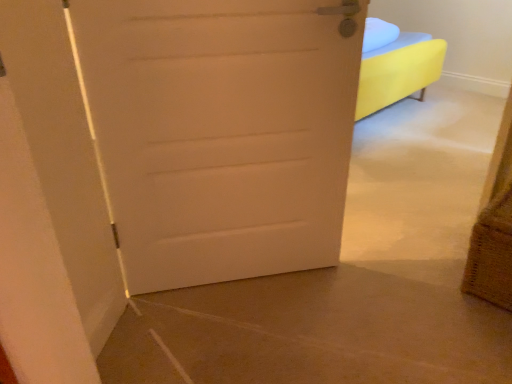
Question: Is white matte door at center spatially inside burlap basket at lower right, or outside of it?

Choices:
 (A) inside
 (B) outside

Answer: (B)

Question: Would you say white matte door at center is to the left or to the right of burlap basket at lower right in the picture?

Choices:
 (A) right
 (B) left

Answer: (B)

Question: Is white matte door at center taller or shorter than burlap basket at lower right?

Choices:
 (A) short
 (B) tall

Answer: (B)

Question: Considering the positions of burlap basket at lower right and white matte door at center in the image, is burlap basket at lower right taller or shorter than white matte door at center?

Choices:
 (A) tall
 (B) short

Answer: (B)

Question: Does point (493, 253) appear closer or farther from the camera than point (147, 140)?

Choices:
 (A) farther
 (B) closer

Answer: (A)

Question: In terms of size, does burlap basket at lower right appear bigger or smaller than white matte door at center?

Choices:
 (A) big
 (B) small

Answer: (B)

Question: From the image's perspective, is burlap basket at lower right located above or below white matte door at center?

Choices:
 (A) above
 (B) below

Answer: (B)